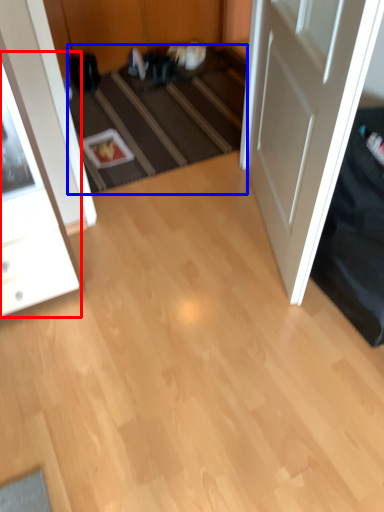
Question: Among these objects, which one is farthest to the camera, cabinetry (highlighted by a red box) or stair (highlighted by a blue box)?

Choices:
 (A) cabinetry
 (B) stair

Answer: (B)